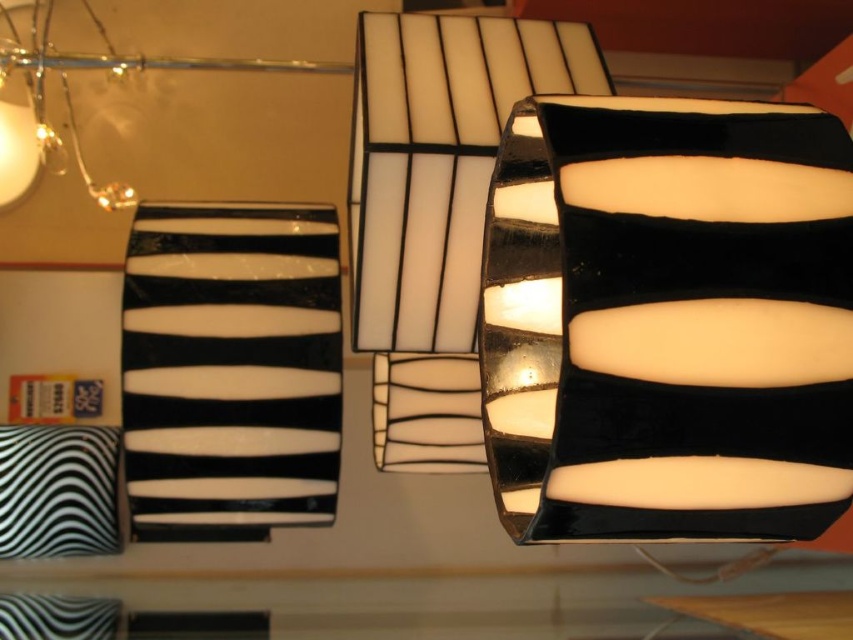
You are an interior designer arranging a modern living room. You have two lamps available, the black glossy lampshade at center and the translucent glass lampshade at upper center. Which lamp is placed higher in the scene?

The translucent glass lampshade at upper center is placed higher than the black glossy lampshade at center in the scene.